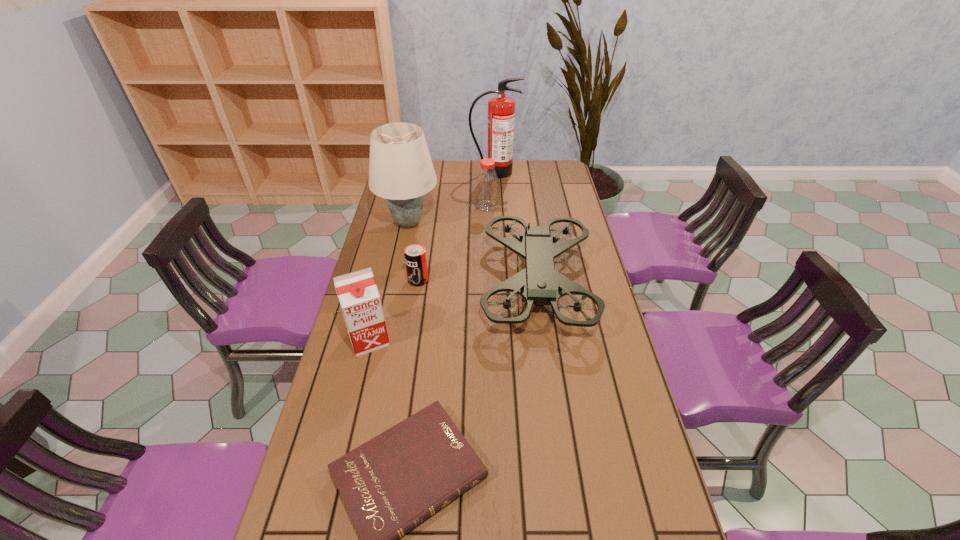
You are a GUI agent. You are given a task and a screenshot of the screen. Output one action in this format:
    pyautogui.click(x=<x>, y=<y>)
    Task: Click on the fire extinguisher
    This screenshot has height=540, width=960.
    Given the screenshot: What is the action you would take?
    pyautogui.click(x=501, y=109)

The image size is (960, 540). Identify the location of lampshade. (400, 168).

Locate an element on the screen. This screenshot has width=960, height=540. drone is located at coordinates (539, 283).

The width and height of the screenshot is (960, 540). I want to click on soya milk, so click(x=357, y=292).

Find the location of a particular element. bottle is located at coordinates (487, 181).

What are the coordinates of `can` in the screenshot? It's located at (414, 254).

Find the location of `blank space located 0.060m on the front-facing side of the fire extinguisher`. blank space located 0.060m on the front-facing side of the fire extinguisher is located at coordinates (494, 185).

Where is `vacant space situated 0.330m on the front of the lampshade`? This screenshot has width=960, height=540. vacant space situated 0.330m on the front of the lampshade is located at coordinates (392, 302).

I want to click on free space located on the front of the drone, so click(564, 472).

Where is `free space located on the right of the soya milk`? free space located on the right of the soya milk is located at coordinates (449, 339).